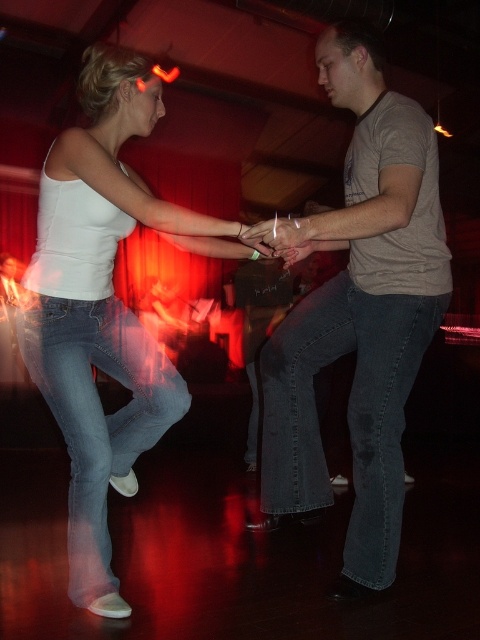
Is blue denim jeans at center further to camera compared to matte skin hand at center?

Yes, blue denim jeans at center is further from the viewer.

Looking at this image, is blue denim jeans at center to the right of matte skin hand at center from the viewer's perspective?

Yes, blue denim jeans at center is to the right of matte skin hand at center.

The width and height of the screenshot is (480, 640). I want to click on blue denim jeans at center, so click(348, 412).

Which of these two, white matte tank top at upper left or blue denim jeans at center, stands taller?

With more height is white matte tank top at upper left.

Which is below, white matte tank top at upper left or blue denim jeans at center?

Positioned lower is blue denim jeans at center.

What are the coordinates of `white matte tank top at upper left` in the screenshot? It's located at (104, 307).

The height and width of the screenshot is (640, 480). What are the coordinates of `white matte tank top at upper left` in the screenshot? It's located at pyautogui.click(x=104, y=307).

Between white matte tank top at upper left and matte skin hand at center, which one has less height?

With less height is matte skin hand at center.

Between point (99, 97) and point (287, 244), which one is positioned in front?

Point (287, 244) is in front.

The height and width of the screenshot is (640, 480). In order to click on white matte tank top at upper left in this screenshot , I will do `click(104, 307)`.